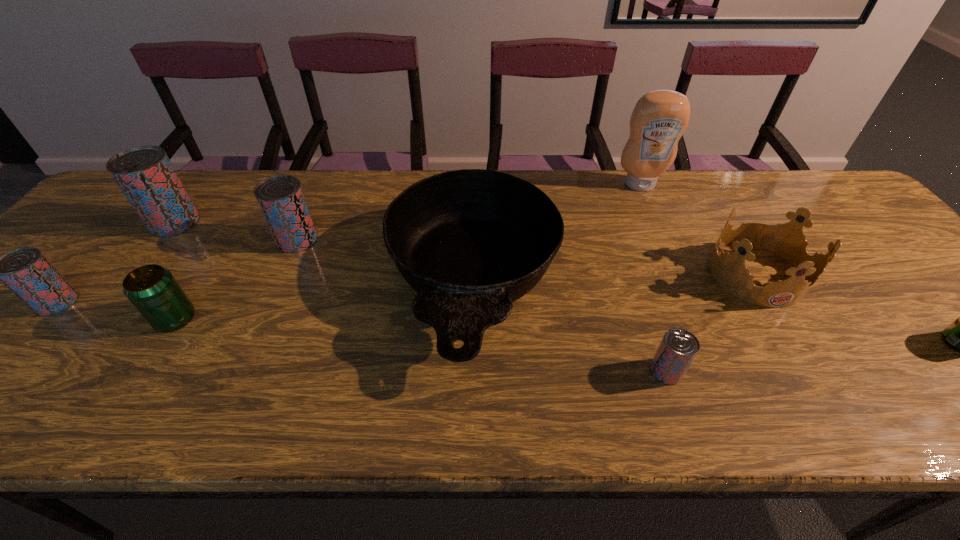
In order to click on free location located 0.130m on the back of the third farthest red beer can in this screenshot , I will do `click(102, 251)`.

At what (x,y) coordinates should I click in order to perform the action: click on vacant region located on the right of the third object from left to right. Please return your answer as a coordinate pair (x, y). Looking at the image, I should click on (227, 319).

Locate an element on the screen. The height and width of the screenshot is (540, 960). vacant space located on the back of the nearest red beer can is located at coordinates [x=630, y=263].

Image resolution: width=960 pixels, height=540 pixels. In order to click on condiment situated at the far edge in this screenshot , I will do `click(659, 119)`.

Identify the location of beer can at the far edge. This screenshot has width=960, height=540. (145, 175).

This screenshot has height=540, width=960. What are the coordinates of `frying pan at the far edge` in the screenshot? It's located at (470, 242).

Locate an element on the screen. Image resolution: width=960 pixels, height=540 pixels. frying pan that is at the near edge is located at coordinates (470, 242).

You are a GUI agent. You are given a task and a screenshot of the screen. Output one action in this format:
    pyautogui.click(x=<x>, y=<y>)
    Task: Click on the beer can that is positioned at the near edge
    
    Given the screenshot: What is the action you would take?
    pyautogui.click(x=678, y=348)

Locate an element on the screen. Image resolution: width=960 pixels, height=540 pixels. object present at the left edge is located at coordinates (25, 271).

Identify the location of vacant space at the far edge of the desktop. (327, 174).